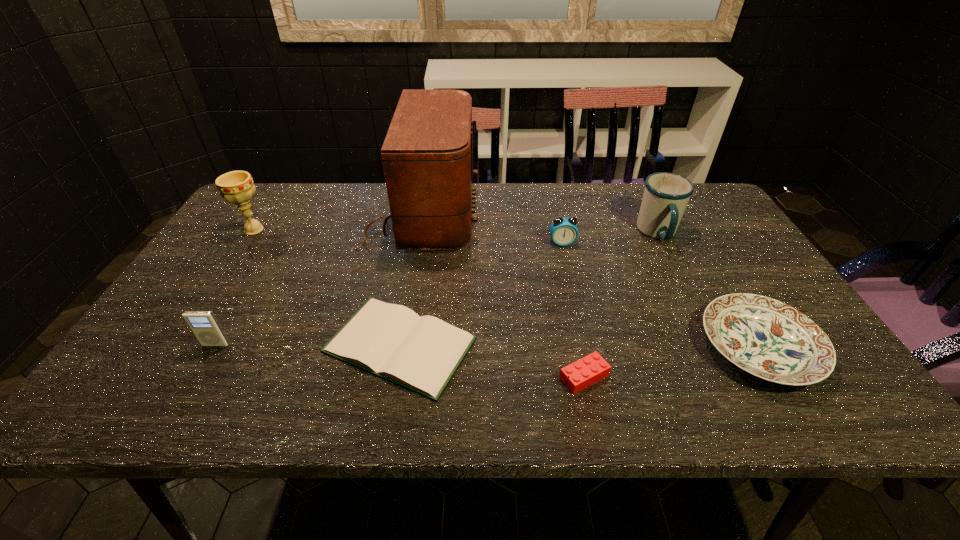
This screenshot has height=540, width=960. What are the coordinates of `the tallest object` in the screenshot? It's located at click(x=427, y=155).

The width and height of the screenshot is (960, 540). Find the location of `chalice`. chalice is located at coordinates (237, 187).

This screenshot has height=540, width=960. Identify the location of mug. (666, 195).

You are a GUI agent. You are given a task and a screenshot of the screen. Output one action in this format:
    pyautogui.click(x=<x>, y=<y>)
    Task: Click on the iPod
    The height and width of the screenshot is (540, 960).
    Given the screenshot: What is the action you would take?
    (204, 325)

I want to click on the fifth shortest object, so click(204, 325).

You are a GUI agent. You are given a task and a screenshot of the screen. Output one action in this format:
    pyautogui.click(x=<x>, y=<y>)
    Task: Click on the alarm clock
    
    Given the screenshot: What is the action you would take?
    (563, 231)

Locate an element on the screen. Image resolution: width=960 pixels, height=540 pixels. the sixth tallest object is located at coordinates (767, 338).

Identify the location of Lego. (592, 368).

Locate an element on the screen. The width and height of the screenshot is (960, 540). hardback book is located at coordinates (420, 353).

I want to click on free spot located on the front panel of the tallest object, so click(x=511, y=215).